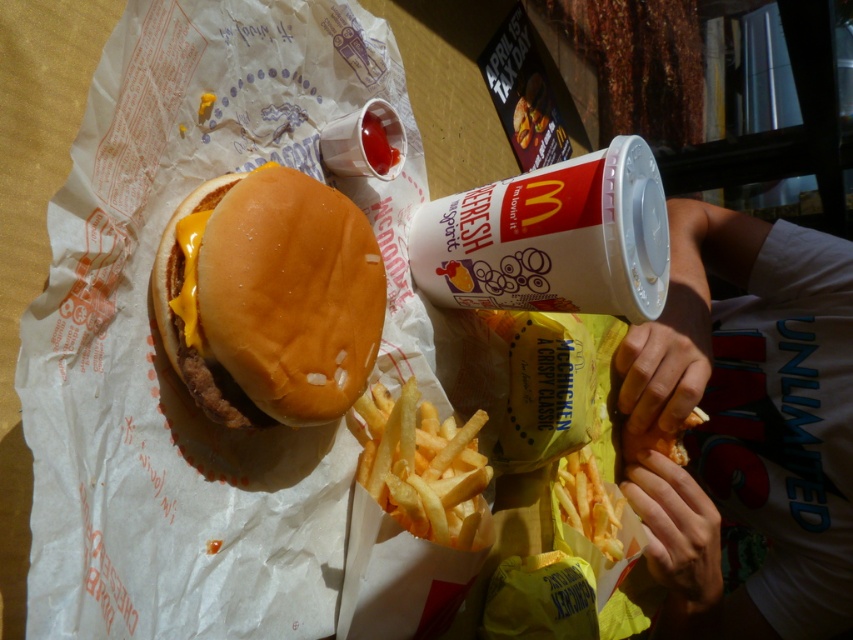
Question: Does white cotton shirt at upper right appear on the right side of slightly toasted bun at center?

Choices:
 (A) no
 (B) yes

Answer: (B)

Question: Based on their relative distances, which object is farther from the yellow crispy french fries at lower center?

Choices:
 (A) white cotton shirt at upper right
 (B) golden crispy french fries at center
 (C) slightly toasted bun at center

Answer: (C)

Question: Does white cotton shirt at upper right appear on the right side of slightly toasted bun at center?

Choices:
 (A) yes
 (B) no

Answer: (A)

Question: Which point is farther to the camera?

Choices:
 (A) click(283, 243)
 (B) click(715, 234)
 (C) click(573, 481)
 (D) click(419, 404)

Answer: (B)

Question: Which of the following is the closest to the observer?

Choices:
 (A) (180, 323)
 (B) (469, 547)
 (C) (622, 508)
 (D) (730, 440)

Answer: (A)

Question: Considering the relative positions of slightly toasted bun at center and golden crispy french fries at center in the image provided, where is slightly toasted bun at center located with respect to golden crispy french fries at center?

Choices:
 (A) below
 (B) above

Answer: (B)